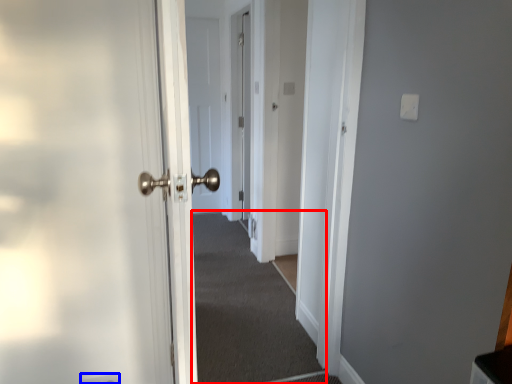
Question: Which object appears closest to the camera in this image, corridor (highlighted by a red box) or electric outlet (highlighted by a blue box)?

Choices:
 (A) corridor
 (B) electric outlet

Answer: (B)